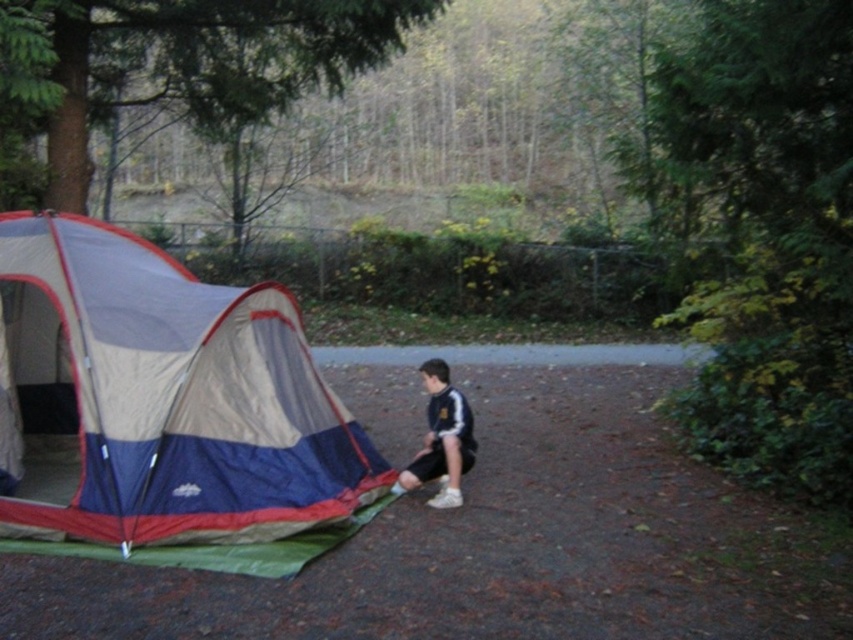
Question: Can you confirm if blue fabric tent at left is positioned to the right of dark blue jersey at center?

Choices:
 (A) yes
 (B) no

Answer: (B)

Question: Which point appears farthest from the camera in this image?

Choices:
 (A) (421, 472)
 (B) (230, 516)

Answer: (A)

Question: Which object appears closest to the camera in this image?

Choices:
 (A) dark blue jersey at center
 (B) blue fabric tent at left

Answer: (B)

Question: Does blue fabric tent at left appear on the left side of dark blue jersey at center?

Choices:
 (A) no
 (B) yes

Answer: (B)

Question: Does blue fabric tent at left come behind dark blue jersey at center?

Choices:
 (A) no
 (B) yes

Answer: (A)